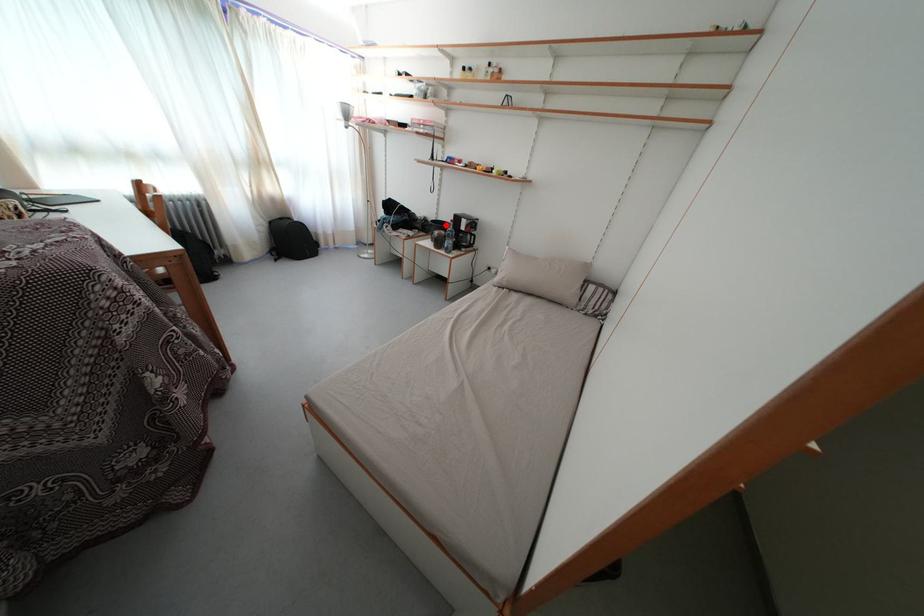
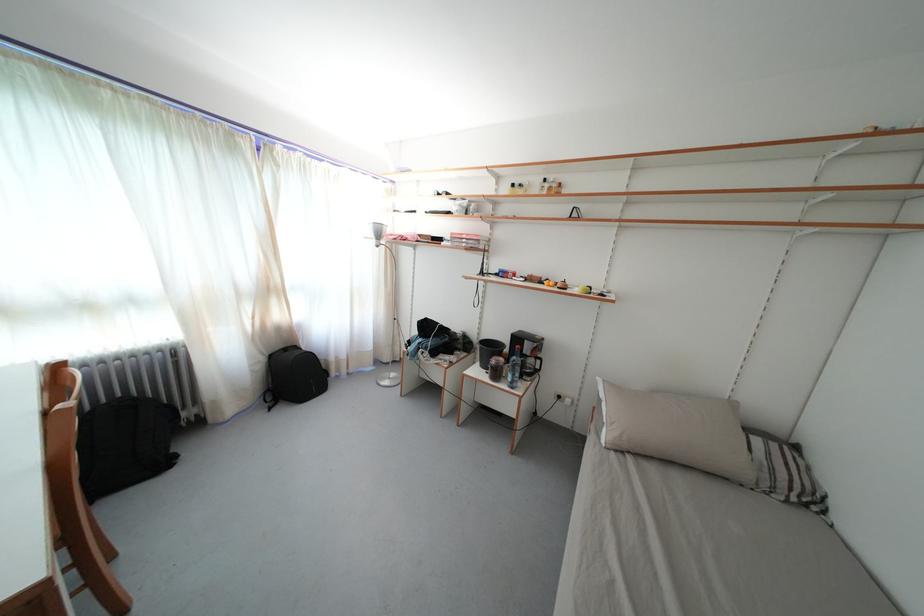
Question: I am providing you with two images of the same scene from different viewpoints. A red point is shown in image1. For the corresponding object point in image2, is it positioned nearer or farther from the camera?

Choices:
 (A) Nearer
 (B) Farther

Answer: (B)